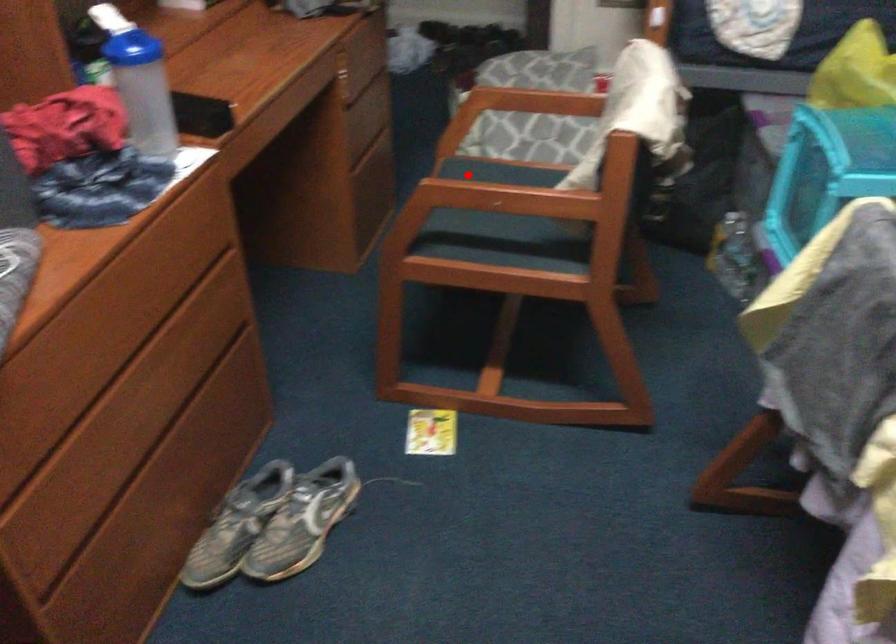
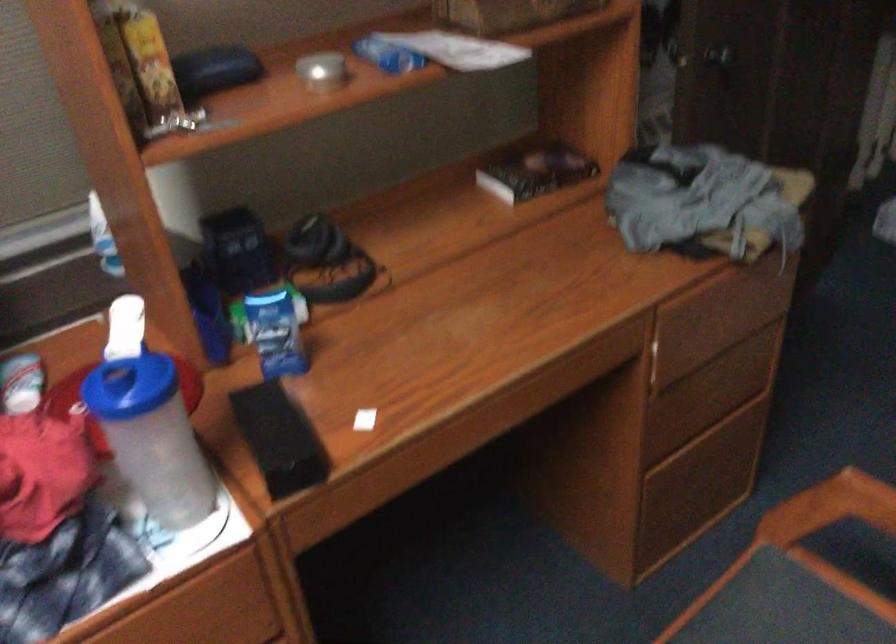
In the second image, find the point that corresponds to the highlighted location in the first image.

(780, 614)